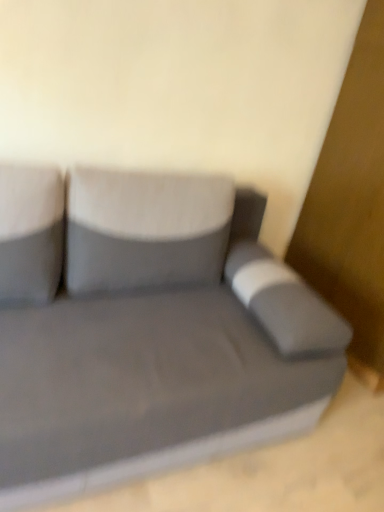
What do you see at coordinates (146, 330) in the screenshot? I see `gray fabric couch at center` at bounding box center [146, 330].

The image size is (384, 512). Find the location of `gray fabric couch at center`. gray fabric couch at center is located at coordinates (146, 330).

In order to face gray fabric couch at center, should I rotate leftwards or rightwards?

Turn left by 4.277 degrees to look at gray fabric couch at center.

Where is `gray fabric couch at center`? The height and width of the screenshot is (512, 384). gray fabric couch at center is located at coordinates (146, 330).